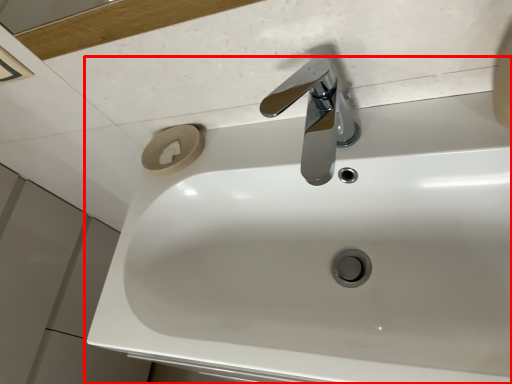
Question: In this image, where is sink (annotated by the red box) located relative to tap?

Choices:
 (A) right
 (B) left

Answer: (B)